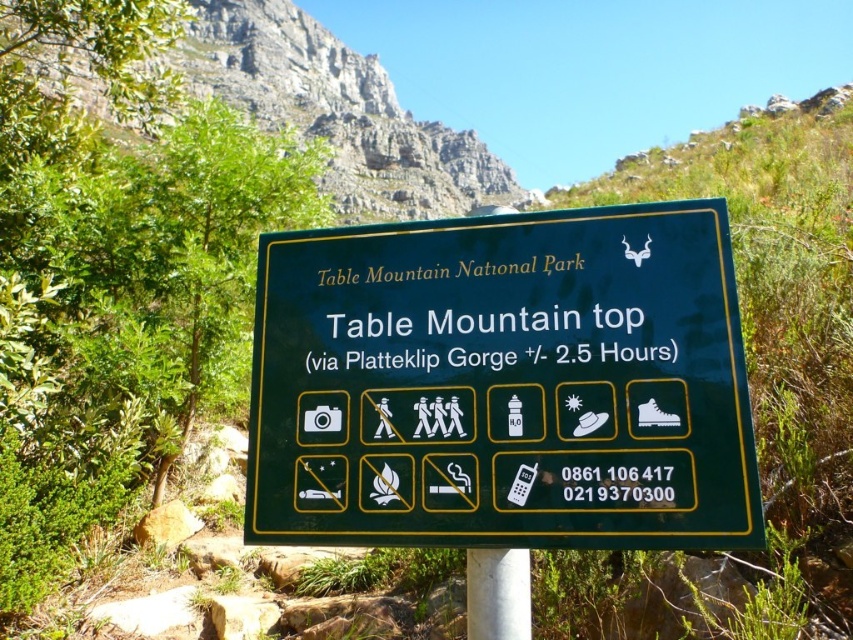
Who is positioned more to the right, green matte sign at center or white smooth pole at center?

white smooth pole at center

Where is `green matte sign at center`? This screenshot has width=853, height=640. green matte sign at center is located at coordinates (503, 384).